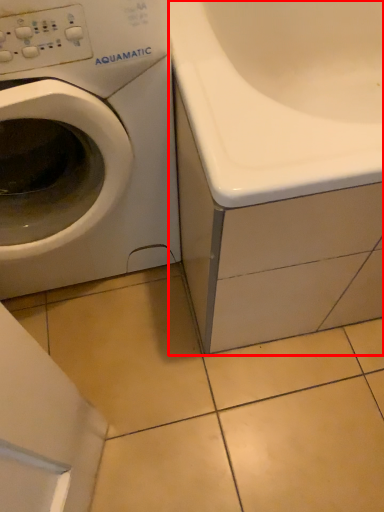
Question: Considering the relative positions of bath (annotated by the red box) and washing machine in the image provided, where is bath (annotated by the red box) located with respect to the staircase?

Choices:
 (A) right
 (B) left

Answer: (A)